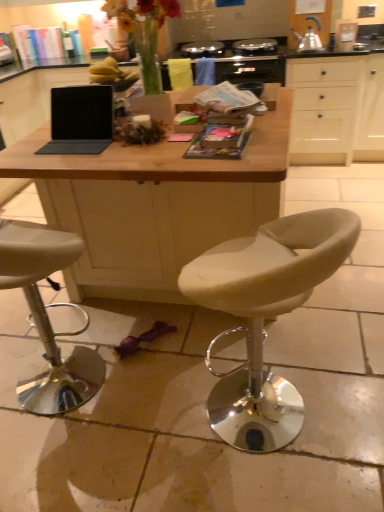
At what (x,y) coordinates should I click in order to perform the action: click on vacant space to the right of white leather stool at center, which is the second chair in left-to-right order. Please return your answer as a coordinate pair (x, y). The height and width of the screenshot is (512, 384). Looking at the image, I should click on (349, 390).